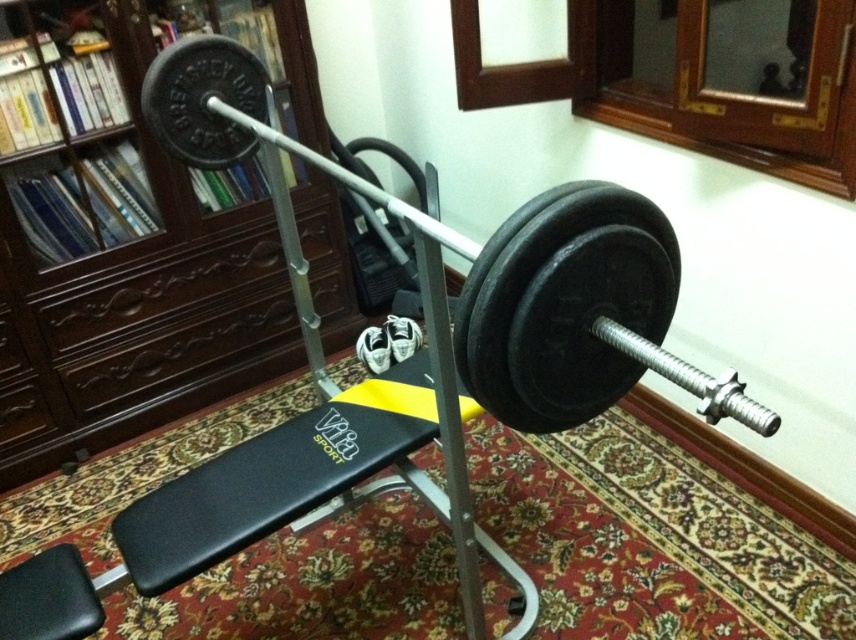
Can you confirm if dark wood bookshelf at upper left is taller than black rubber barbell at center?

Yes, dark wood bookshelf at upper left is taller than black rubber barbell at center.

How distant is dark wood bookshelf at upper left from black rubber barbell at center?

dark wood bookshelf at upper left is 30.86 inches from black rubber barbell at center.

Is point (171, 227) farther from viewer compared to point (265, 122)?

Yes, it is behind point (265, 122).

At what (x,y) coordinates should I click in order to perform the action: click on dark wood bookshelf at upper left. Please return your answer as a coordinate pair (x, y). The height and width of the screenshot is (640, 856). Looking at the image, I should click on (132, 234).